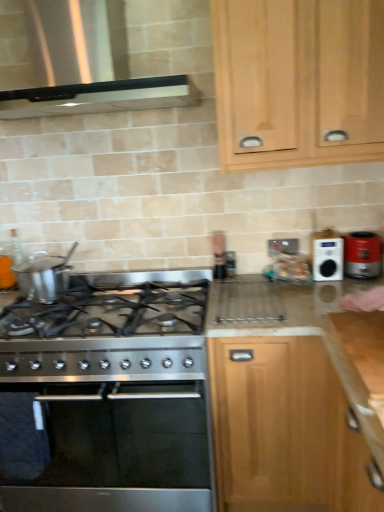
Question: Can we say light wood cabinet at upper right, the 2th cabinetry ordered from the bottom, lies outside metallic silver outlet at upper center?

Choices:
 (A) no
 (B) yes

Answer: (B)

Question: Is light wood cabinet at upper right, positioned as the first cabinetry in top-to-bottom order, smaller than metallic silver outlet at upper center?

Choices:
 (A) yes
 (B) no

Answer: (B)

Question: Does light wood cabinet at upper right, positioned as the first cabinetry in top-to-bottom order, contain metallic silver outlet at upper center?

Choices:
 (A) no
 (B) yes

Answer: (A)

Question: Are light wood cabinet at upper right, positioned as the first cabinetry in top-to-bottom order, and metallic silver outlet at upper center located far from each other?

Choices:
 (A) no
 (B) yes

Answer: (A)

Question: Can you confirm if light wood cabinet at upper right, positioned as the first cabinetry in top-to-bottom order, is taller than metallic silver outlet at upper center?

Choices:
 (A) no
 (B) yes

Answer: (B)

Question: Considering the relative sizes of light wood cabinet at upper right, the 2th cabinetry ordered from the bottom, and metallic silver outlet at upper center in the image provided, is light wood cabinet at upper right, the 2th cabinetry ordered from the bottom, shorter than metallic silver outlet at upper center?

Choices:
 (A) yes
 (B) no

Answer: (B)

Question: Considering the relative sizes of metallic silver outlet at upper center and white plastic radio at upper right in the image provided, is metallic silver outlet at upper center thinner than white plastic radio at upper right?

Choices:
 (A) yes
 (B) no

Answer: (A)

Question: Is metallic silver outlet at upper center to the right of white plastic radio at upper right from the viewer's perspective?

Choices:
 (A) yes
 (B) no

Answer: (B)

Question: From the image's perspective, is metallic silver outlet at upper center under white plastic radio at upper right?

Choices:
 (A) no
 (B) yes

Answer: (A)

Question: Considering the relative sizes of metallic silver outlet at upper center and white plastic radio at upper right in the image provided, is metallic silver outlet at upper center shorter than white plastic radio at upper right?

Choices:
 (A) no
 (B) yes

Answer: (B)

Question: Is metallic silver outlet at upper center far away from white plastic radio at upper right?

Choices:
 (A) yes
 (B) no

Answer: (B)

Question: Could white plastic radio at upper right be considered to be inside metallic silver outlet at upper center?

Choices:
 (A) yes
 (B) no

Answer: (B)

Question: Can you confirm if stainless steel oven at lower left is shorter than matte red toaster at right?

Choices:
 (A) yes
 (B) no

Answer: (B)